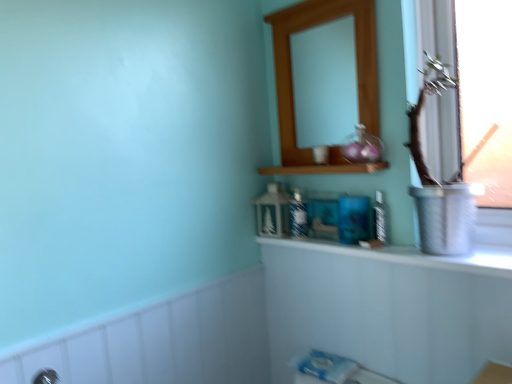
Question: Can you confirm if wooden medicine cabinet at upper center is thinner than white glossy counter top at upper center?

Choices:
 (A) no
 (B) yes

Answer: (B)

Question: Does wooden medicine cabinet at upper center have a lesser height compared to white glossy counter top at upper center?

Choices:
 (A) no
 (B) yes

Answer: (A)

Question: Considering the relative sizes of wooden medicine cabinet at upper center and white glossy counter top at upper center in the image provided, is wooden medicine cabinet at upper center taller than white glossy counter top at upper center?

Choices:
 (A) yes
 (B) no

Answer: (A)

Question: From a real-world perspective, is wooden medicine cabinet at upper center positioned over white glossy counter top at upper center based on gravity?

Choices:
 (A) no
 (B) yes

Answer: (B)

Question: Is wooden medicine cabinet at upper center at the right side of white glossy counter top at upper center?

Choices:
 (A) no
 (B) yes

Answer: (A)

Question: Could you tell me if wooden medicine cabinet at upper center is facing white glossy counter top at upper center?

Choices:
 (A) no
 (B) yes

Answer: (A)

Question: Can wooden shelf at upper center be found inside matte blue glass toiletry at center, which is the 1th toiletry in left-to-right order?

Choices:
 (A) no
 (B) yes

Answer: (A)

Question: From the image's perspective, is matte blue glass toiletry at center, which is the 1th toiletry in left-to-right order, below wooden shelf at upper center?

Choices:
 (A) yes
 (B) no

Answer: (A)

Question: Is matte blue glass toiletry at center, positioned as the second toiletry in right-to-left order, far away from wooden shelf at upper center?

Choices:
 (A) yes
 (B) no

Answer: (B)

Question: From a real-world perspective, is matte blue glass toiletry at center, positioned as the second toiletry in right-to-left order, beneath wooden shelf at upper center?

Choices:
 (A) no
 (B) yes

Answer: (B)

Question: Considering the relative positions of matte blue glass toiletry at center, which is the second toiletry from front to back, and wooden shelf at upper center in the image provided, is matte blue glass toiletry at center, which is the second toiletry from front to back, to the left of wooden shelf at upper center from the viewer's perspective?

Choices:
 (A) yes
 (B) no

Answer: (A)

Question: Considering the relative sizes of matte blue glass toiletry at center, positioned as the second toiletry in right-to-left order, and wooden shelf at upper center in the image provided, is matte blue glass toiletry at center, positioned as the second toiletry in right-to-left order, bigger than wooden shelf at upper center?

Choices:
 (A) yes
 (B) no

Answer: (B)

Question: From a real-world perspective, is white glossy counter top at upper center under wooden medicine cabinet at upper center?

Choices:
 (A) yes
 (B) no

Answer: (A)